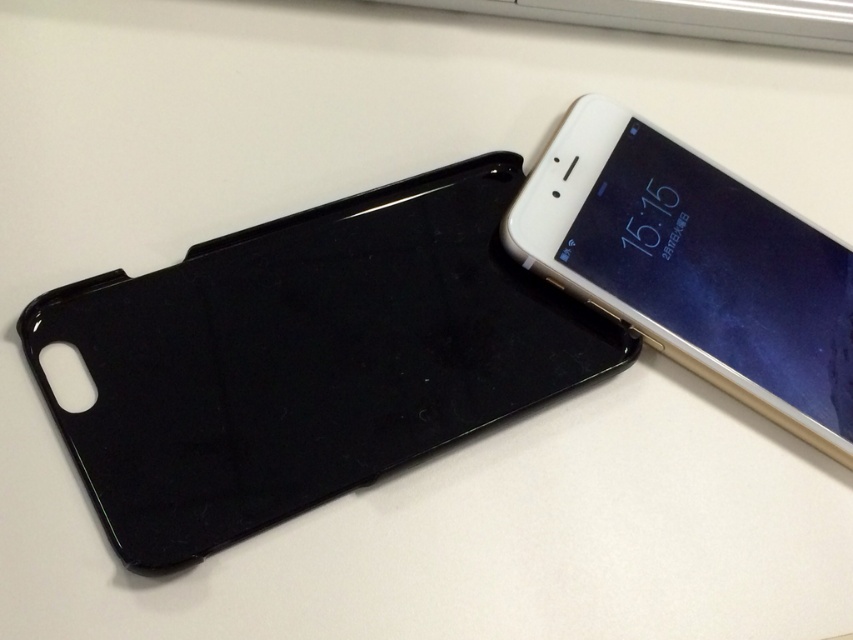
Is black matte phone case at lower left bigger than white glossy smartphone at upper right?

Yes, black matte phone case at lower left is bigger than white glossy smartphone at upper right.

The image size is (853, 640). What do you see at coordinates (306, 358) in the screenshot? I see `black matte phone case at lower left` at bounding box center [306, 358].

Locate an element on the screen. Image resolution: width=853 pixels, height=640 pixels. black matte phone case at lower left is located at coordinates (306, 358).